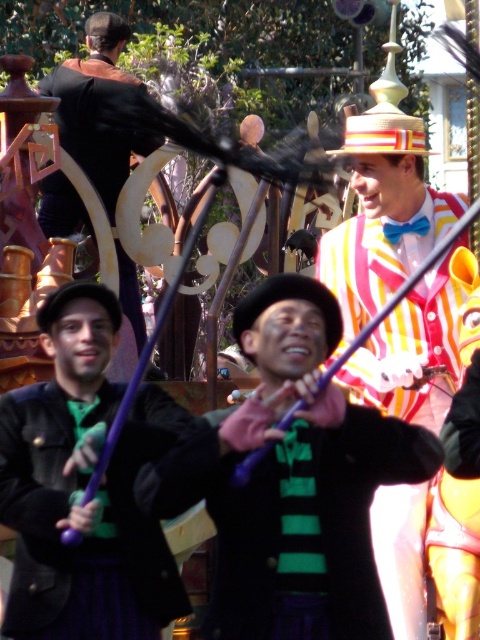
You are a photographer trying to capture the matte purple wand at center in a photo. The two performers in black suits with green accents are standing 64.69 meters away from the wand. Can you fit both performers and the wand into a single frame without moving any of them?

The two performers in black suits with green accents are 64.69 meters away from the matte purple wand at center. Since they are so far apart, it may be challenging to fit both into a single frame without moving them. Adjusting the camera to a wide angle or moving closer might help, but without moving the subjects, it could be difficult.

You are a photographer at the theme park and need to capture a photo of the matte purple wand at center and the striped cotton suit at center. Based on their positions, which object should you focus on first to ensure both are in frame?

The matte purple wand at center is positioned on the left side of the striped cotton suit at center, so you should focus on the striped cotton suit at center first to ensure both are in frame.

You are a photographer trying to capture the perfect shot of the green striped scarf at center. The theme park has a rule that you must stay within a 1 meter radius of your current position. If the green striped scarf at center is exactly at point (284, 515), can you reach it within the allowed distance?

The green striped scarf at center is located at point (284, 515). Since the photographer must stay within a 1 meter radius of their current position, they can reach the scarf if their current position is within that distance from the scarf. However, without knowing the photographer exact starting point, it is impossible to determine if the distance requirement is met.